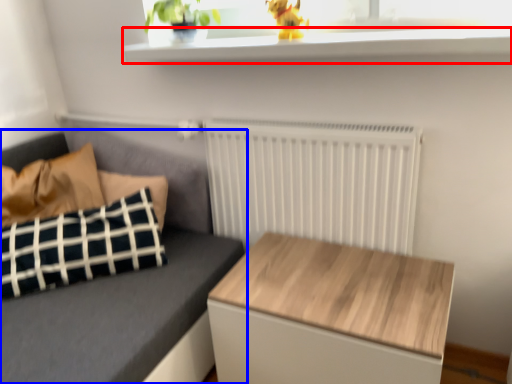
Question: Which of the following is the farthest to the observer, window sill (highlighted by a red box) or studio couch (highlighted by a blue box)?

Choices:
 (A) window sill
 (B) studio couch

Answer: (B)